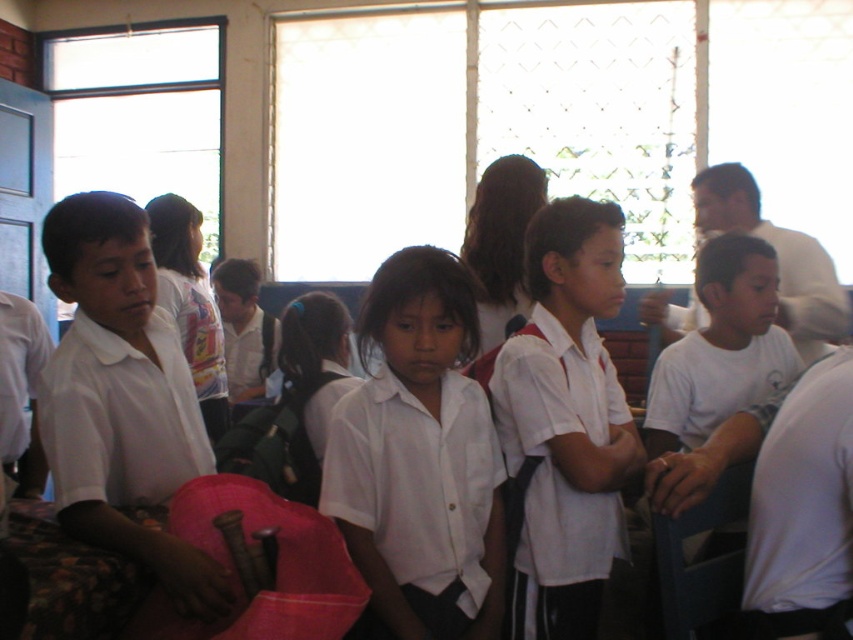
Question: Estimate the real-world distances between objects in this image. Which object is farther from the white smooth shirt at right?

Choices:
 (A) white matte shirt at center
 (B) white cotton shirt at center

Answer: (B)

Question: Estimate the real-world distances between objects in this image. Which object is closer to the white matte uniform shirt at center?

Choices:
 (A) white matte shirt at center
 (B) matte white shirt at left
 (C) white matte uniform shirt at left
 (D) white cotton shirt at center

Answer: (A)

Question: Can you confirm if white matte shirt at center is bigger than white cotton shirt at center?

Choices:
 (A) yes
 (B) no

Answer: (B)

Question: Is the position of white matte shirt at center more distant than that of white cotton shirt at center?

Choices:
 (A) no
 (B) yes

Answer: (A)

Question: Which of the following is the closest to the observer?

Choices:
 (A) (811, 243)
 (B) (822, 504)

Answer: (B)

Question: Is white matte uniform shirt at center further to camera compared to white smooth shirt at right?

Choices:
 (A) no
 (B) yes

Answer: (B)